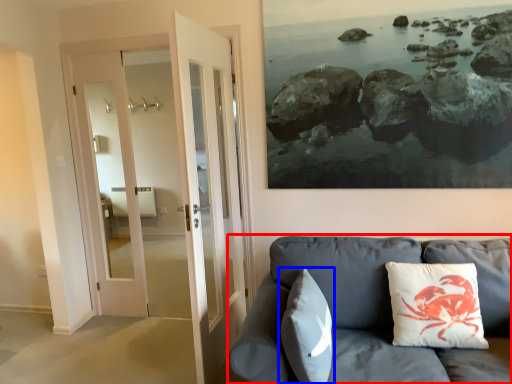
Question: Which of the following is the farthest to the observer, studio couch (highlighted by a red box) or pillow (highlighted by a blue box)?

Choices:
 (A) studio couch
 (B) pillow

Answer: (B)